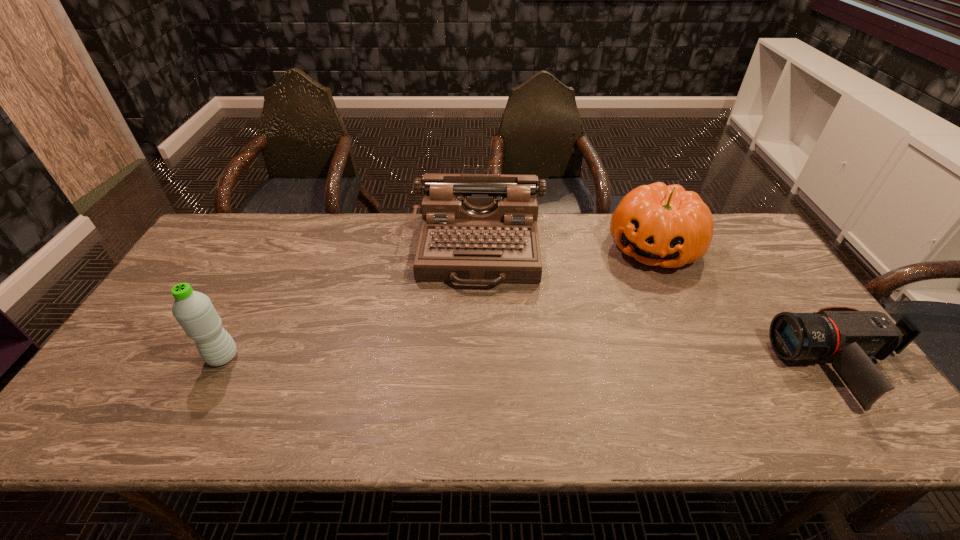
Where is `object positioned at the near right corner`? object positioned at the near right corner is located at coordinates (851, 339).

I want to click on vacant space at the far edge of the desktop, so click(255, 249).

Identify the location of free location at the near edge of the desktop. (270, 372).

Locate an element on the screen. Image resolution: width=960 pixels, height=540 pixels. free space at the right edge of the desktop is located at coordinates (771, 264).

Find the location of `vacant point at the far left corner`. vacant point at the far left corner is located at coordinates (236, 220).

In the image, there is a desktop. Identify the location of vacant space at the near left corner. This screenshot has width=960, height=540. (144, 387).

Locate an element on the screen. The image size is (960, 540). free space at the far right corner of the desktop is located at coordinates (716, 226).

Where is `free spot between the water bottle and the typewriter`? The width and height of the screenshot is (960, 540). free spot between the water bottle and the typewriter is located at coordinates (351, 302).

I want to click on free space that is in between the typewriter and the second object from right to left, so click(566, 248).

Find the location of a particular element. free spot between the water bottle and the typewriter is located at coordinates coord(351,302).